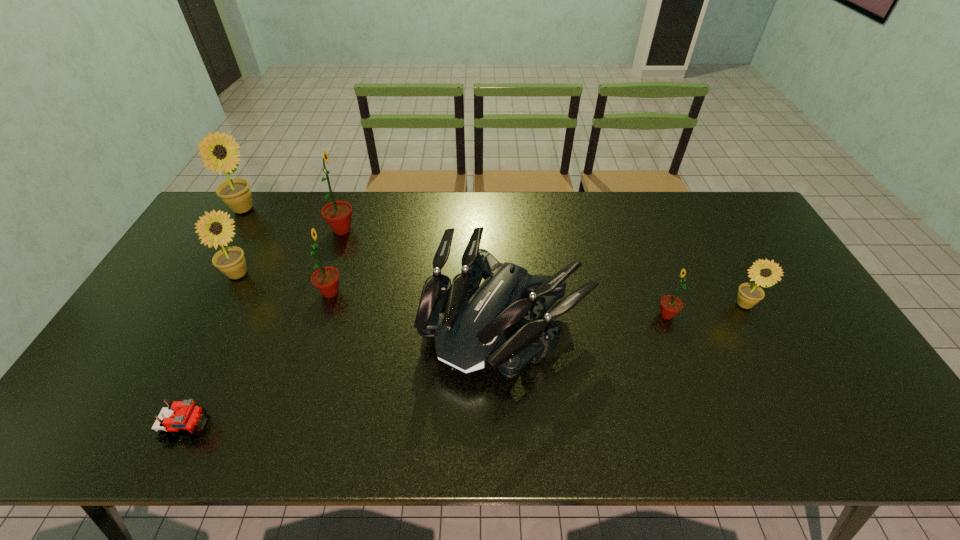
Locate an element on the screen. drone is located at coordinates (472, 332).

Identify the location of Lego. point(184,416).

Identify the location of the nearest object. The image size is (960, 540). (184, 416).

Where is `free region located on the face of the leftmost yellow sunflower`? This screenshot has width=960, height=540. free region located on the face of the leftmost yellow sunflower is located at coordinates (296, 210).

Image resolution: width=960 pixels, height=540 pixels. I want to click on free space located on the face of the biggest green sunflower, so click(443, 230).

This screenshot has height=540, width=960. I want to click on free space located 0.270m on the face of the second yellow sunflower from left to right, so click(x=342, y=275).

Find the location of a particular element. Image resolution: width=960 pixels, height=540 pixels. vacant space located on the face of the second nearest green sunflower is located at coordinates (416, 292).

Find the location of a particular element. The width and height of the screenshot is (960, 540). free space located 0.290m on the face of the second object from right to left is located at coordinates (552, 315).

In order to click on vacant region located 0.290m on the face of the second object from right to left in this screenshot , I will do `click(552, 315)`.

Identify the location of free spot located on the face of the second object from right to left. (631, 315).